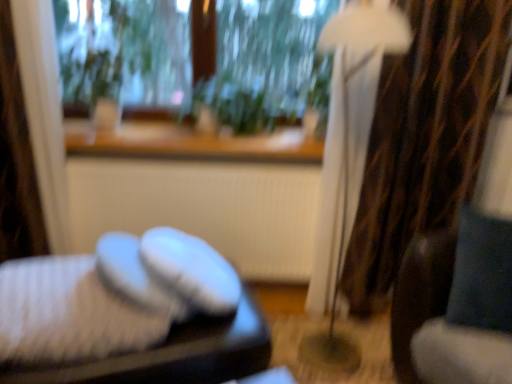
Identify the location of vacant space situated above white knitted socks at lower left (from a real-world perspective). The image size is (512, 384). (60, 276).